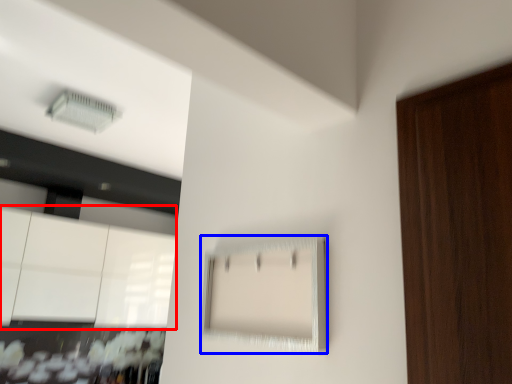
Question: Which object is further to the camera taking this photo, cabinetry (highlighted by a red box) or cabinetry (highlighted by a blue box)?

Choices:
 (A) cabinetry
 (B) cabinetry

Answer: (A)